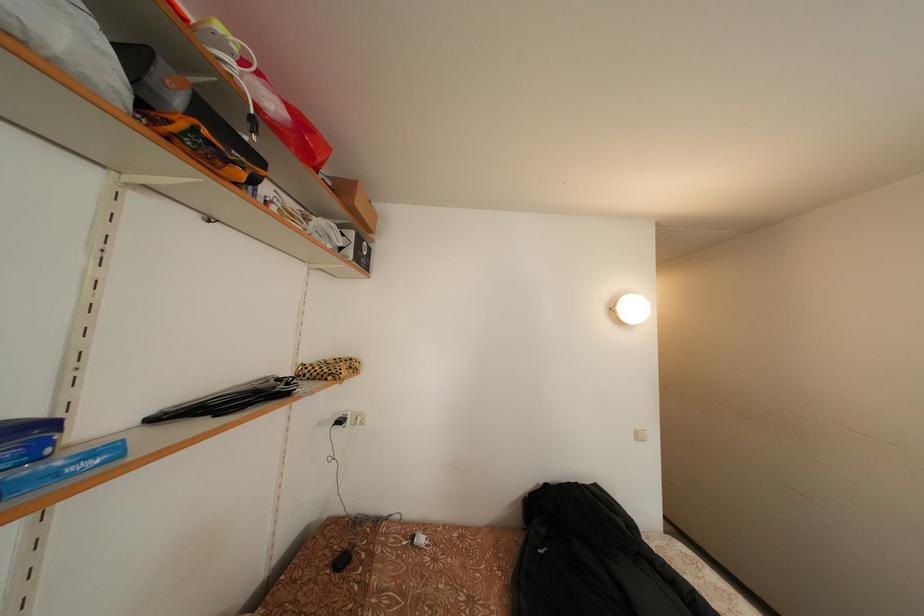
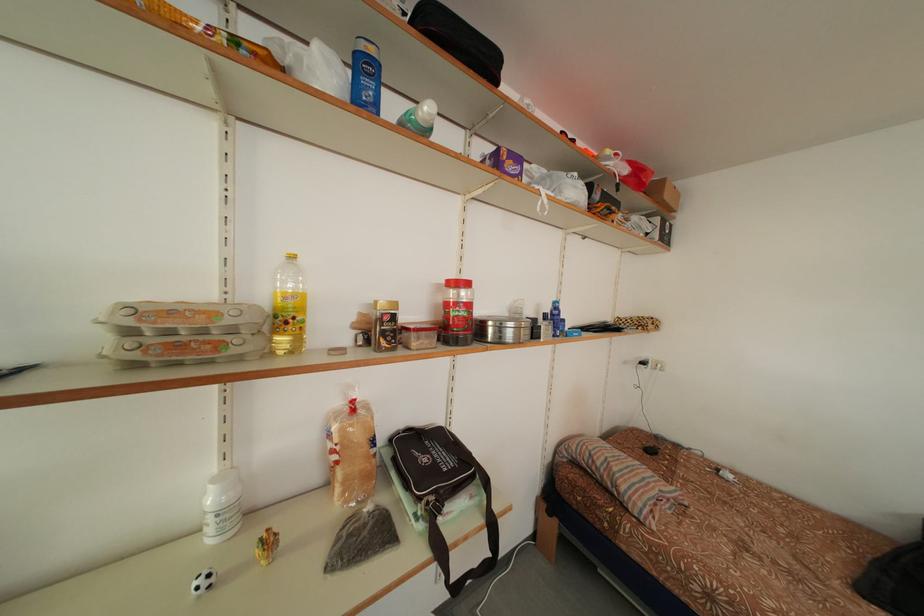
The point at (347, 428) is marked in the first image. Where is the corresponding point in the second image?

(650, 369)